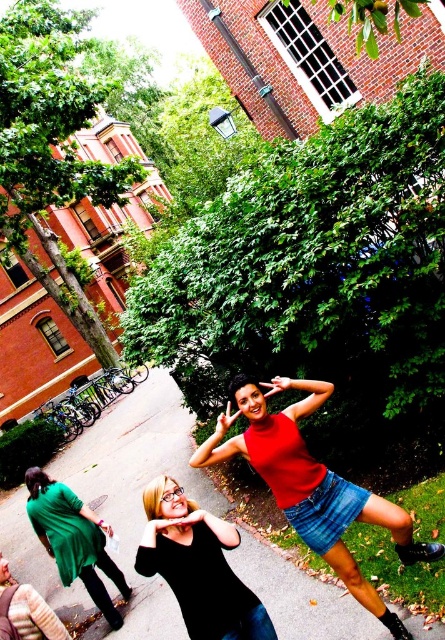
From the picture: You are organizing a fashion show and need to place the matte red tank top at center and the green matte dress at lower left on a runway. Which outfit takes up more horizontal space when displayed?

The matte red tank top at center takes up more horizontal space than the green matte dress at lower left because its width surpasses the latter.

You are standing at the entrance of the campus and see the matte red tank top at center in the distance. If you walk straight towards it for 3 meters, will you be able to see it clearly?

The matte red tank top at center is 3.66 meters away from the viewer. After walking 3 meters towards it, you will be 0.66 meters away, so yes, you can see it clearly.